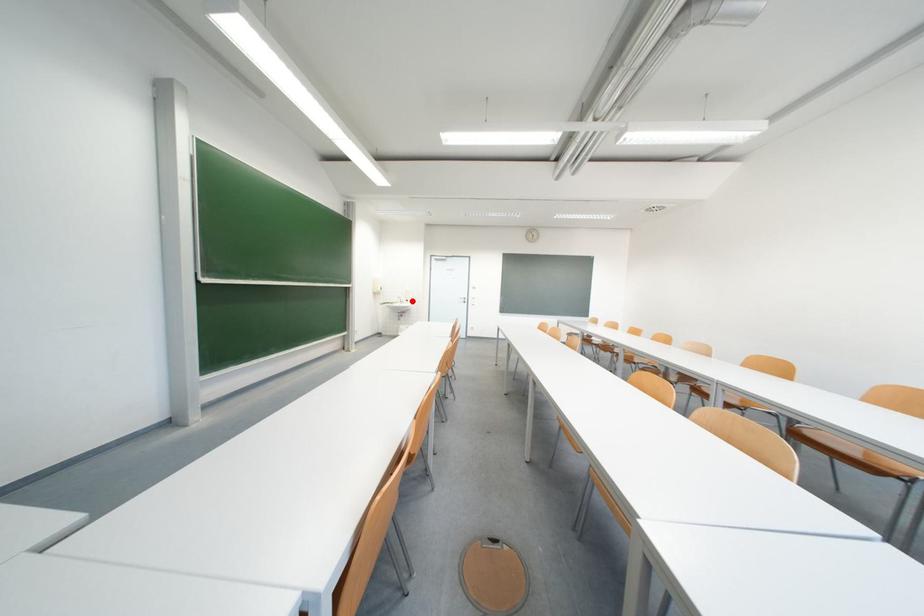
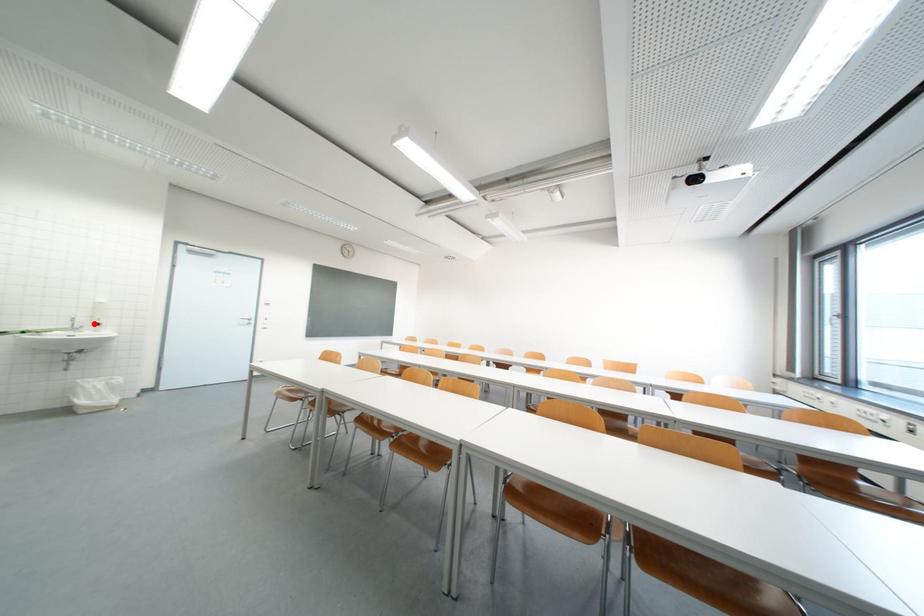
I am providing you with two images of the same scene from different viewpoints. A red point is marked on the first image and another point is marked on the second image. Is the marked point in image1 the same physical position as the marked point in image2?

Yes